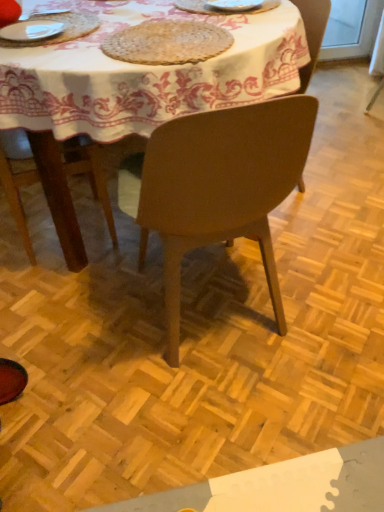
Identify the location of vacant region to the left of matte brown chair at center, which ranks as the 2th chair in back-to-front order. Image resolution: width=384 pixels, height=512 pixels. (77, 315).